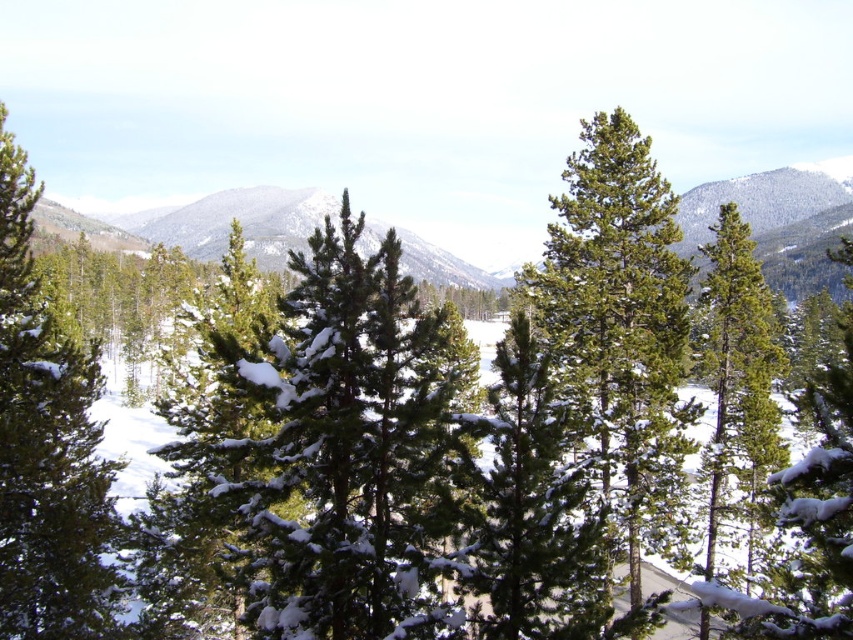
Who is positioned more to the left, green needle-like at center or green matte tree at left?

green matte tree at left is more to the left.

Does green needle-like at center appear over green matte tree at left?

Yes.

Which is behind, point (618, 346) or point (25, 246)?

The point (618, 346) is behind.

The image size is (853, 640). Find the location of `green needle-like at center`. green needle-like at center is located at coordinates (619, 323).

Is green needle-like at center positioned before green matte tree at right?

No.

Is point (625, 465) farther from camera compared to point (744, 285)?

No, (625, 465) is in front of (744, 285).

Who is more forward, (585, 308) or (764, 305)?

Positioned in front is point (585, 308).

Where is `green needle-like at center`? The width and height of the screenshot is (853, 640). green needle-like at center is located at coordinates (619, 323).

Between point (74, 465) and point (715, 531), which one is positioned in front?

Point (715, 531) is in front.

Does green matte tree at left have a greater height compared to green matte tree at right?

Yes.

Where is `green matte tree at left`? This screenshot has width=853, height=640. green matte tree at left is located at coordinates (47, 448).